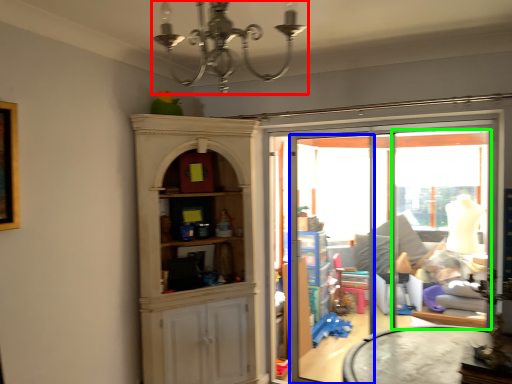
Question: Which is farther away from light fixture (highlighted by a red box)? screen door (highlighted by a blue box) or window (highlighted by a green box)?

Choices:
 (A) screen door
 (B) window

Answer: (B)